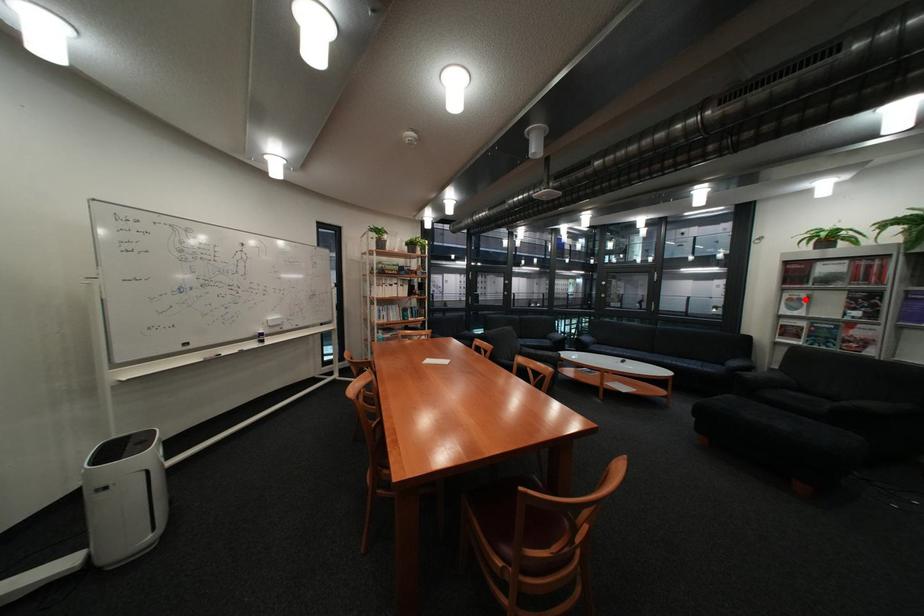
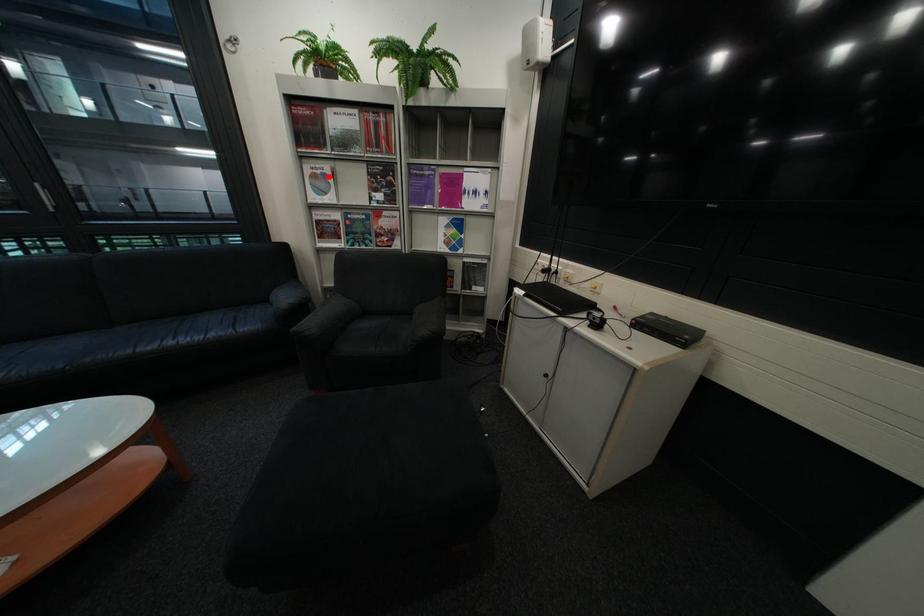
Looking at this image, I am providing you with two images of the same scene from different viewpoints. A red point is marked on the first image and another point is marked on the second image. Are the points marked in image1 and image2 representing the same 3D position?

Yes